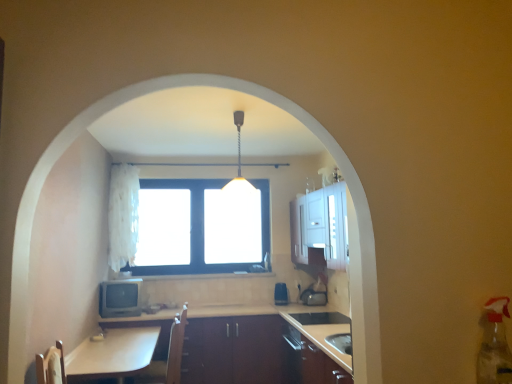
Question: Can you confirm if matte gray television at lower left, the second appliance when ordered from right to left, is thinner than wooden at center?

Choices:
 (A) no
 (B) yes

Answer: (B)

Question: Does matte gray television at lower left, the 1th appliance positioned from the front, have a greater width compared to wooden at center?

Choices:
 (A) yes
 (B) no

Answer: (B)

Question: Is wooden at center completely or partially inside matte gray television at lower left, placed as the first appliance when sorted from left to right?

Choices:
 (A) yes
 (B) no

Answer: (B)

Question: Is wooden at center at the back of matte gray television at lower left, the second appliance when ordered from right to left?

Choices:
 (A) yes
 (B) no

Answer: (B)

Question: Is matte gray television at lower left, the second appliance when ordered from right to left, bigger than wooden at center?

Choices:
 (A) yes
 (B) no

Answer: (B)

Question: Does matte gray television at lower left, which is the second appliance in back-to-front order, come in front of wooden at center?

Choices:
 (A) yes
 (B) no

Answer: (B)

Question: Is wooden at center facing towards white glossy table at lower left?

Choices:
 (A) yes
 (B) no

Answer: (A)

Question: From a real-world perspective, is wooden at center below white glossy table at lower left?

Choices:
 (A) no
 (B) yes

Answer: (B)

Question: Is wooden at center completely or partially outside of white glossy table at lower left?

Choices:
 (A) no
 (B) yes

Answer: (B)

Question: Does wooden at center have a lesser height compared to white glossy table at lower left?

Choices:
 (A) no
 (B) yes

Answer: (A)

Question: Is white glossy table at lower left at the back of wooden at center?

Choices:
 (A) no
 (B) yes

Answer: (A)

Question: Would you say wooden at center contains white glossy table at lower left?

Choices:
 (A) yes
 (B) no

Answer: (B)

Question: Is brown leather swivel chair at lower left outside matte gray television at lower left, the second appliance when ordered from right to left?

Choices:
 (A) no
 (B) yes

Answer: (B)